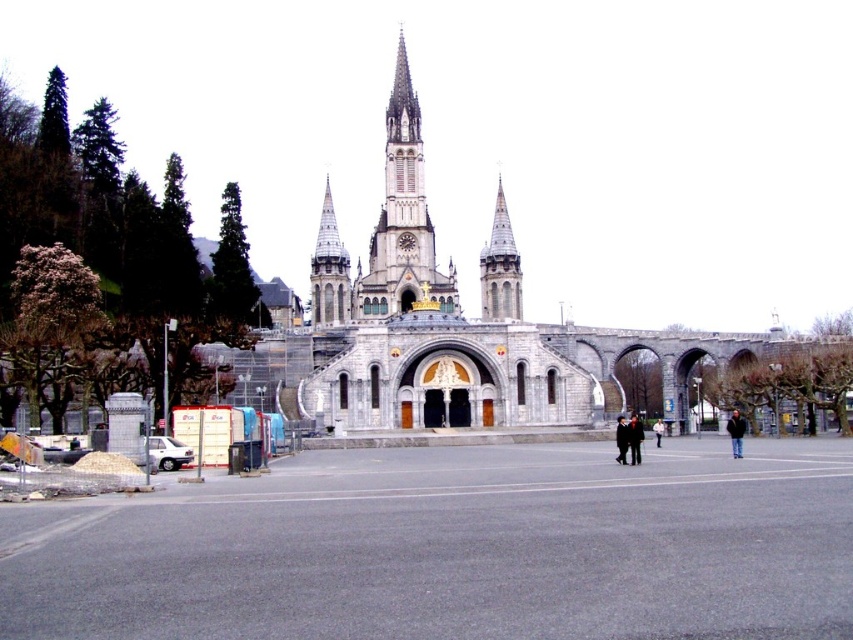
Question: Does gray stone church at center appear on the left side of black leather jacket at center?

Choices:
 (A) yes
 (B) no

Answer: (A)

Question: Can you confirm if gray stone church at center is thinner than dark gray suit at center?

Choices:
 (A) yes
 (B) no

Answer: (B)

Question: Which point is closer to the camera?

Choices:
 (A) (630, 451)
 (B) (412, 154)
 (C) (492, 296)

Answer: (A)

Question: Considering the relative positions of gray stone church at center and gray stone spire at center in the image provided, where is gray stone church at center located with respect to gray stone spire at center?

Choices:
 (A) right
 (B) left

Answer: (A)

Question: Based on their relative distances, which object is farther from the gray stone church at center?

Choices:
 (A) gray stone spire at center
 (B) smooth stone spire at center
 (C) black leather jacket at center
 (D) dark gray suit at center

Answer: (C)

Question: Which point is closer to the camera taking this photo?

Choices:
 (A) (322, 305)
 (B) (730, 433)
 (C) (378, 340)
 (D) (624, 448)

Answer: (D)